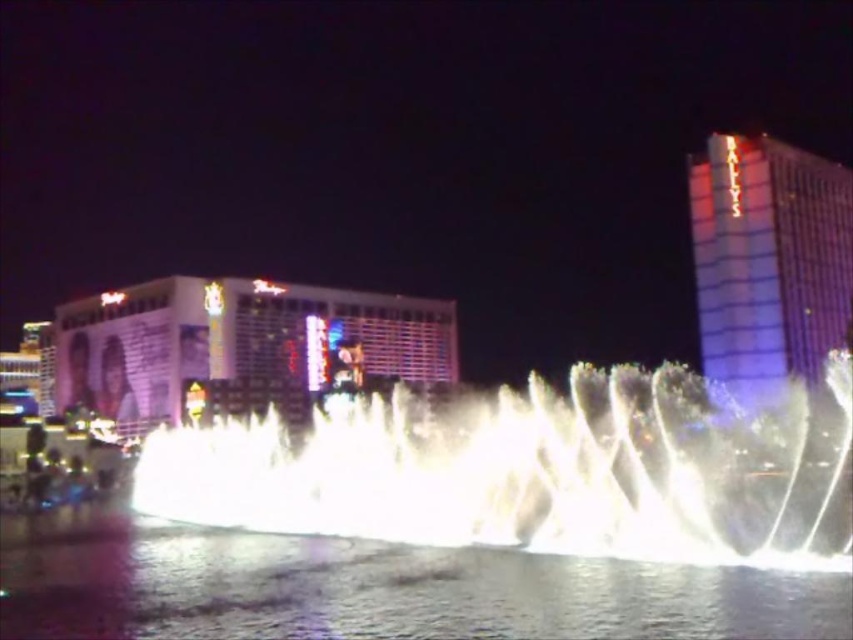
You are standing in the entertainment area and want to take a photo of the white frothy water at center and the matte glass hotel at center. Which object should you focus on first to ensure both are in the frame?

You should focus on the matte glass hotel at center first because the white frothy water at center is in front of it, so adjusting the focus to the background object ensures both are in the frame.

You are a photographer planning to capture the entire scene in one shot. Given that the white frothy water at center and the matte glass hotel at center are both important elements, which object should you prioritize framing closer to the edge of the photo to ensure the other remains visible?

Since the white frothy water at center occupies less space than the matte glass hotel at center, you should prioritize framing the larger matte glass hotel at center closer to the edge to ensure the smaller white frothy water at center remains visible in the shot.

You are standing at the point marked as point (x=375, y=588) in the image. What substance are you currently standing on?

You are standing on clear liquid water at center.